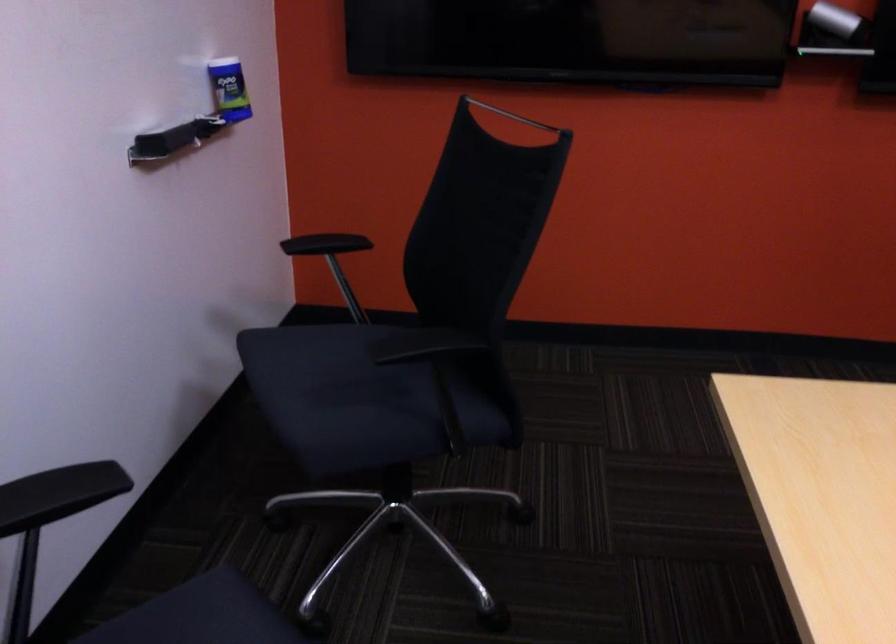
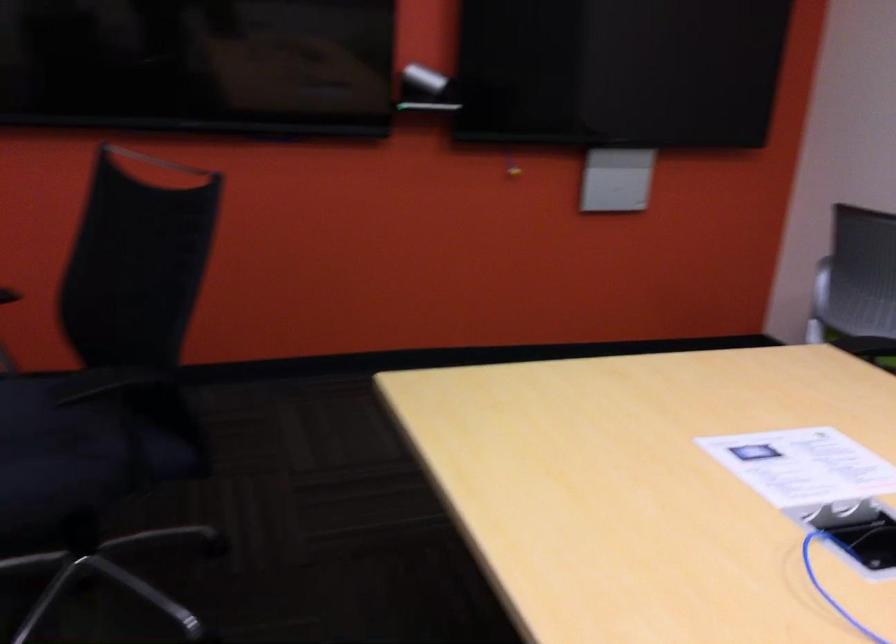
Where in the second image is the point corresponding to (398,408) from the first image?

(82, 450)